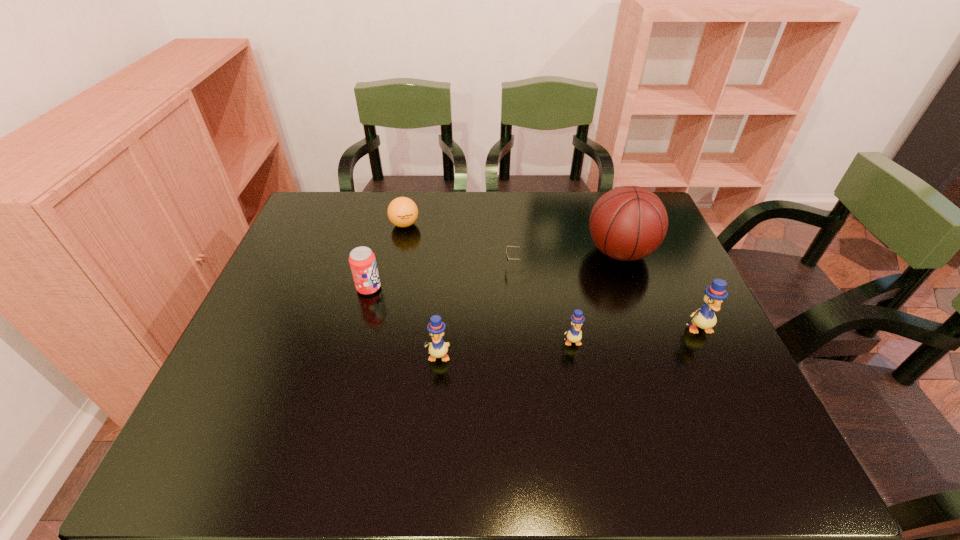
Find the location of `vacant space at the near left corner of the desktop`. vacant space at the near left corner of the desktop is located at coordinates (210, 413).

The width and height of the screenshot is (960, 540). Identify the location of vacant space at the near right corner of the desktop. (694, 394).

Where is `blank region between the basketball and the fifth object from left to right`? This screenshot has height=540, width=960. blank region between the basketball and the fifth object from left to right is located at coordinates (596, 297).

Where is `free space between the leftmost duckling and the second duckling from left to right`? This screenshot has height=540, width=960. free space between the leftmost duckling and the second duckling from left to right is located at coordinates click(505, 349).

I want to click on free spot between the soda can and the third object from right to left, so click(x=470, y=315).

The image size is (960, 540). I want to click on empty space between the ping-pong ball and the leftmost duckling, so click(x=421, y=290).

You are a GUI agent. You are given a task and a screenshot of the screen. Output one action in this format:
    pyautogui.click(x=<x>, y=<y>)
    Task: Click on the free space between the fourth object from left to right and the ping-pong ball
    The height and width of the screenshot is (540, 960).
    Given the screenshot: What is the action you would take?
    pyautogui.click(x=460, y=245)

Identify the location of vacant space that's between the third object from left to right and the basketball. Image resolution: width=960 pixels, height=540 pixels. (529, 304).

Locate an element on the screen. Image resolution: width=960 pixels, height=540 pixels. free space between the basketball and the shortest duckling is located at coordinates (596, 297).

Locate an element on the screen. Image resolution: width=960 pixels, height=540 pixels. empty location between the tallest object and the shortest duckling is located at coordinates 596,297.